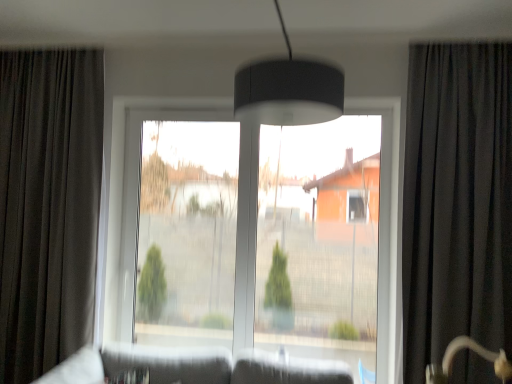
Question: Looking at the image, does transparent glass window screen at center seem bigger or smaller compared to black velvet curtain at right, marked as the second curtain in a left-to-right arrangement?

Choices:
 (A) small
 (B) big

Answer: (A)

Question: From the image's perspective, is transparent glass window screen at center located above or below black velvet curtain at right, marked as the second curtain in a left-to-right arrangement?

Choices:
 (A) below
 (B) above

Answer: (A)

Question: Estimate the real-world distances between objects in this image. Which object is farther from the black velvet curtain at right, which is the 1th curtain from right to left?

Choices:
 (A) dark grey fabric curtain at left, the 2th curtain from the right
 (B) transparent glass window screen at center
 (C) transparent glass window at center

Answer: (A)

Question: Considering the real-world distances, which object is farthest from the dark grey fabric curtain at left, the 2th curtain from the right?

Choices:
 (A) transparent glass window at center
 (B) black velvet curtain at right, which is the 1th curtain from right to left
 (C) transparent glass window screen at center

Answer: (B)